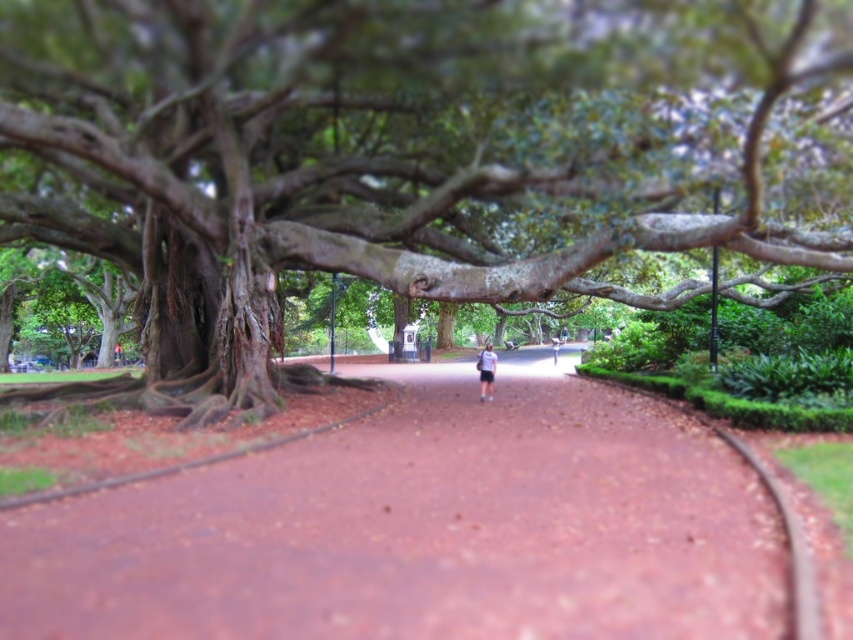
I want to click on reddish-brown concrete pavement at center, so click(424, 528).

Find the location of a particular element. This screenshot has width=853, height=640. reddish-brown concrete pavement at center is located at coordinates (424, 528).

Find the location of a particular element. This screenshot has height=640, width=853. reddish-brown concrete pavement at center is located at coordinates (424, 528).

Can you confirm if reddish-brown concrete pavement at center is shorter than white cotton shirt at center?

Yes, reddish-brown concrete pavement at center is shorter than white cotton shirt at center.

Is reddish-brown concrete pavement at center closer to camera compared to white cotton shirt at center?

Yes, reddish-brown concrete pavement at center is in front of white cotton shirt at center.

Does point (643, 621) lie behind point (558, 349)?

No.

Where is `reddish-brown concrete pavement at center`? This screenshot has width=853, height=640. reddish-brown concrete pavement at center is located at coordinates 424,528.

Is white fabric shirt at center thinner than white cotton shirt at center?

Correct, white fabric shirt at center's width is less than white cotton shirt at center's.

This screenshot has height=640, width=853. I want to click on white fabric shirt at center, so click(486, 371).

Find the location of `white fabric shirt at center`. white fabric shirt at center is located at coordinates (486, 371).